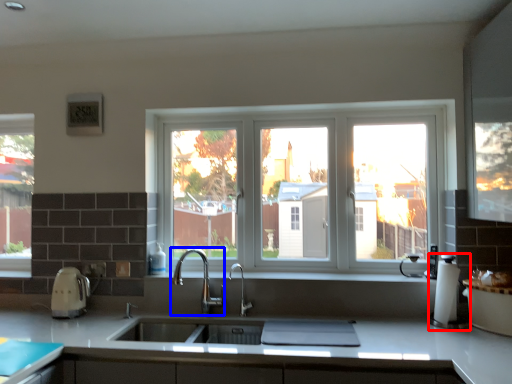
Question: Which object is further to the camera taking this photo, coffee machine (highlighted by a red box) or tap (highlighted by a blue box)?

Choices:
 (A) coffee machine
 (B) tap

Answer: (B)